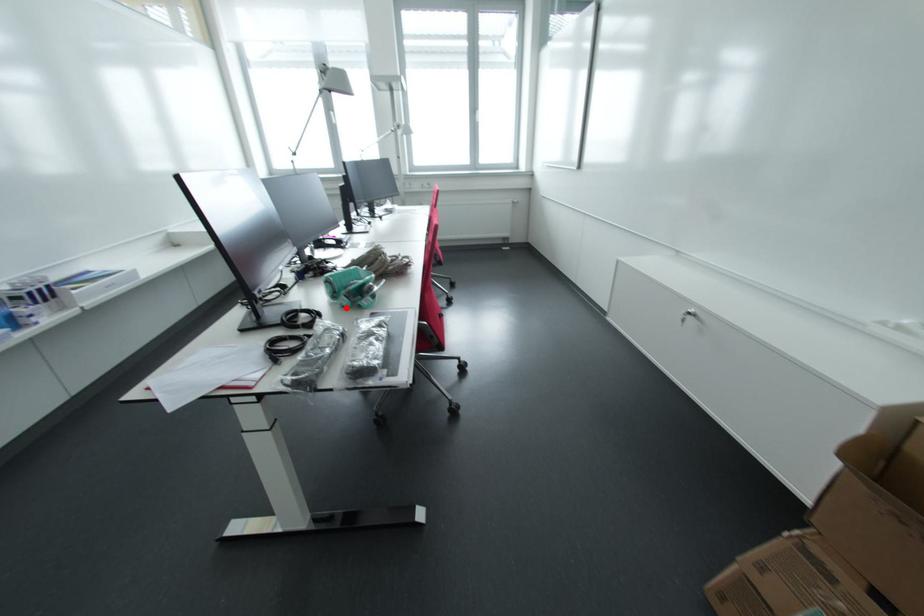
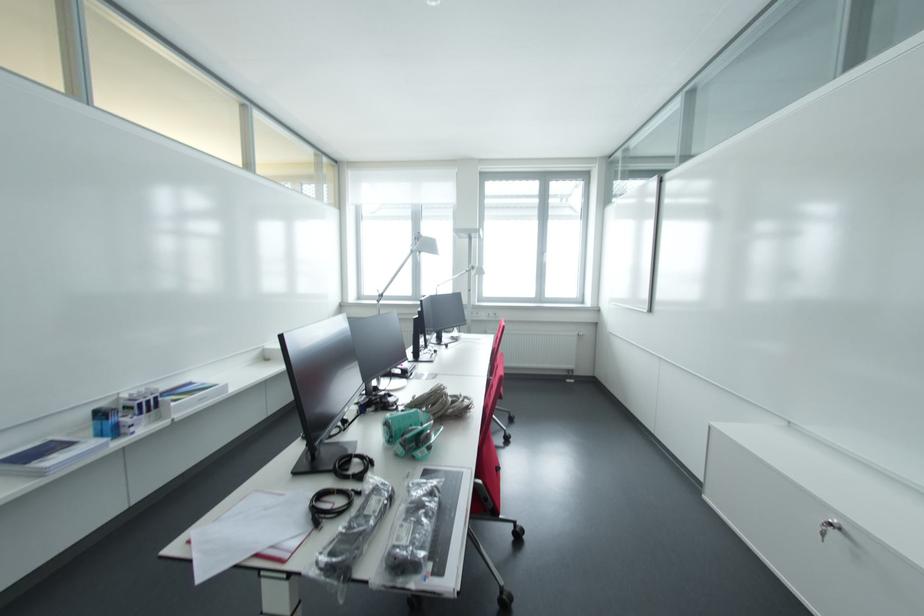
Locate, in the second image, the point that corresponds to the highlighted location in the first image.

(400, 456)